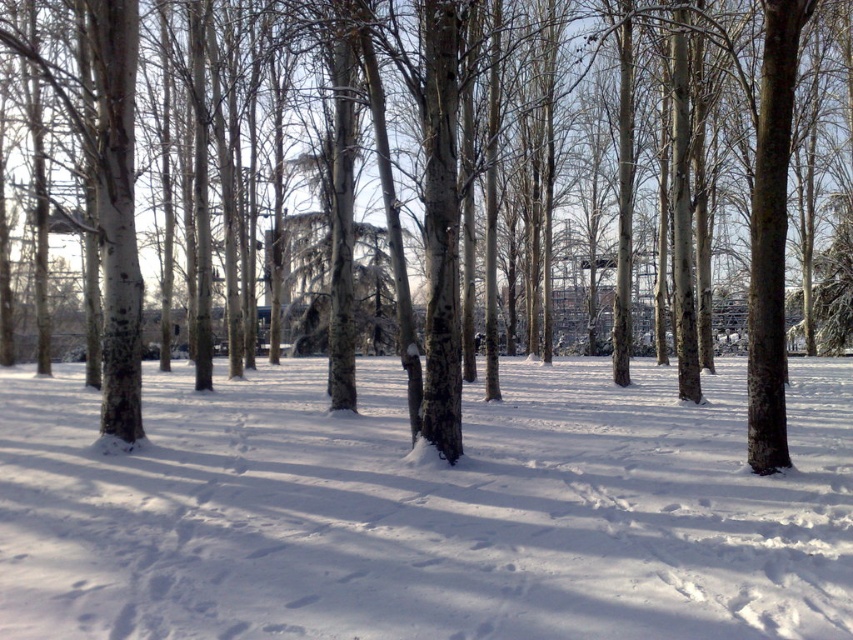
What do you see at coordinates (425, 509) in the screenshot? Image resolution: width=853 pixels, height=640 pixels. I see `white powdery snow at center` at bounding box center [425, 509].

Can you confirm if white powdery snow at center is bigger than brown bark tree at center?

No, white powdery snow at center is not bigger than brown bark tree at center.

I want to click on white powdery snow at center, so click(x=425, y=509).